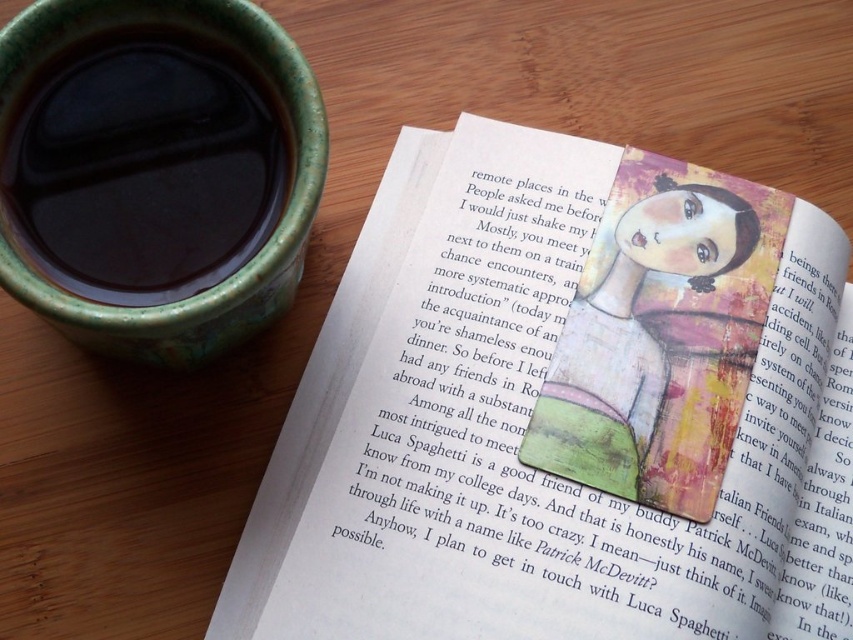
Question: Which of these objects is positioned closest to the matte paper bookmark at center?

Choices:
 (A) matte painted doll at center
 (B) matte green cup at upper left

Answer: (A)

Question: Which point is farther to the camera?

Choices:
 (A) matte paper bookmark at center
 (B) matte painted doll at center
 (C) matte green cup at upper left

Answer: (B)

Question: Does matte paper bookmark at center have a smaller size compared to matte green cup at upper left?

Choices:
 (A) yes
 (B) no

Answer: (B)

Question: Can you confirm if matte green cup at upper left is wider than matte painted doll at center?

Choices:
 (A) no
 (B) yes

Answer: (A)

Question: Which of the following is the farthest from the observer?

Choices:
 (A) matte painted doll at center
 (B) matte paper bookmark at center
 (C) matte green cup at upper left

Answer: (A)

Question: Can you confirm if matte paper bookmark at center is positioned above matte green cup at upper left?

Choices:
 (A) yes
 (B) no

Answer: (B)